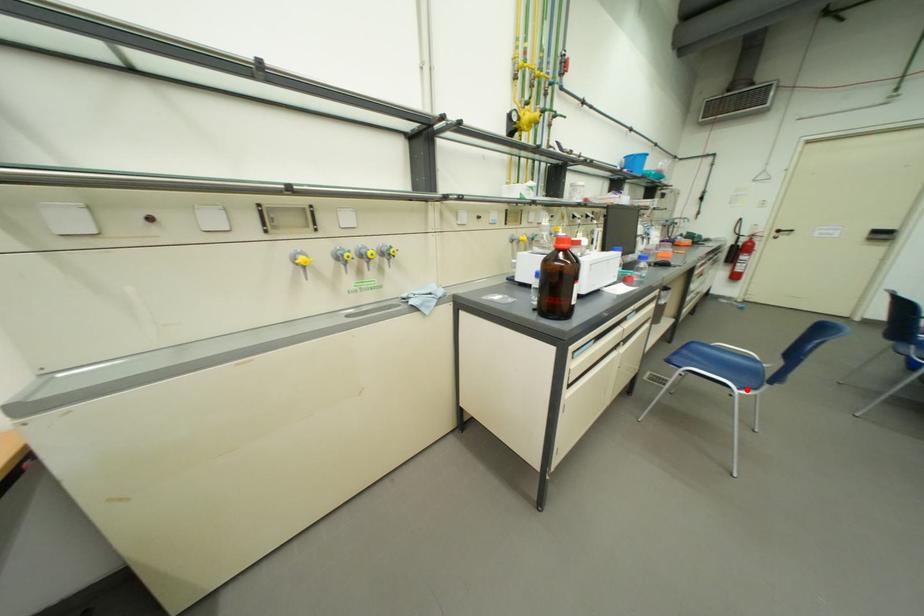
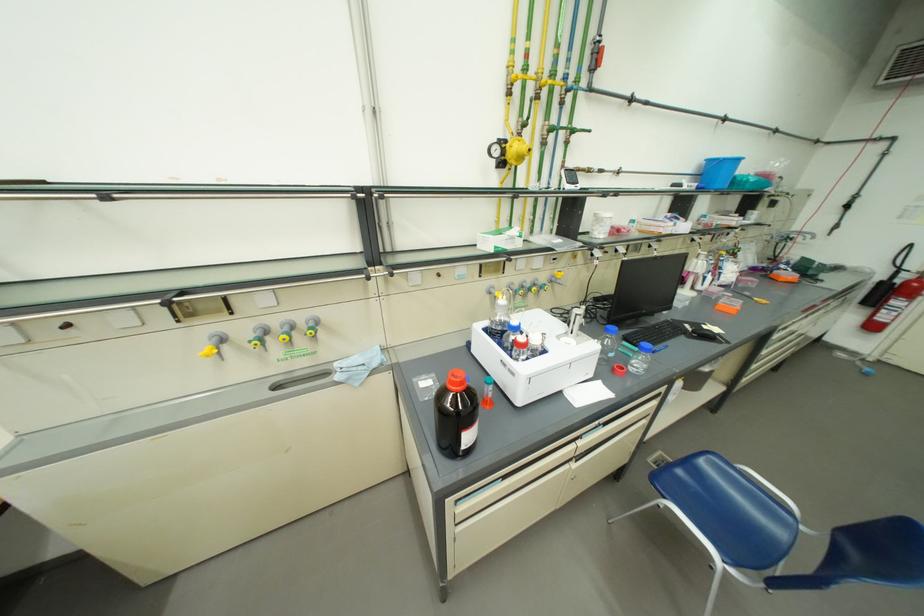
Question: I am providing you with two images of the same scene from different viewpoints. A red point is shown in image1. For the corresponding object point in image2, is it positioned nearer or farther from the camera?

Choices:
 (A) Nearer
 (B) Farther

Answer: (B)